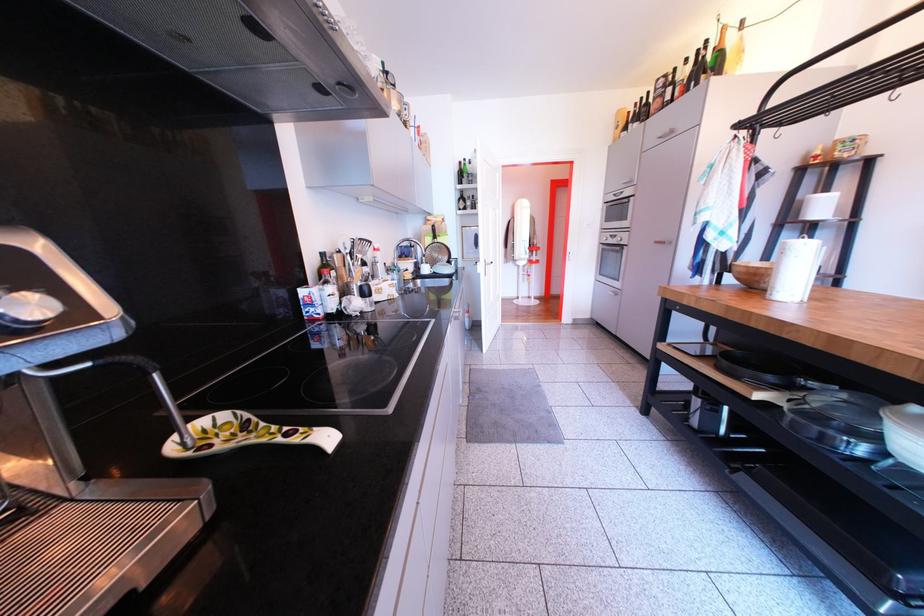
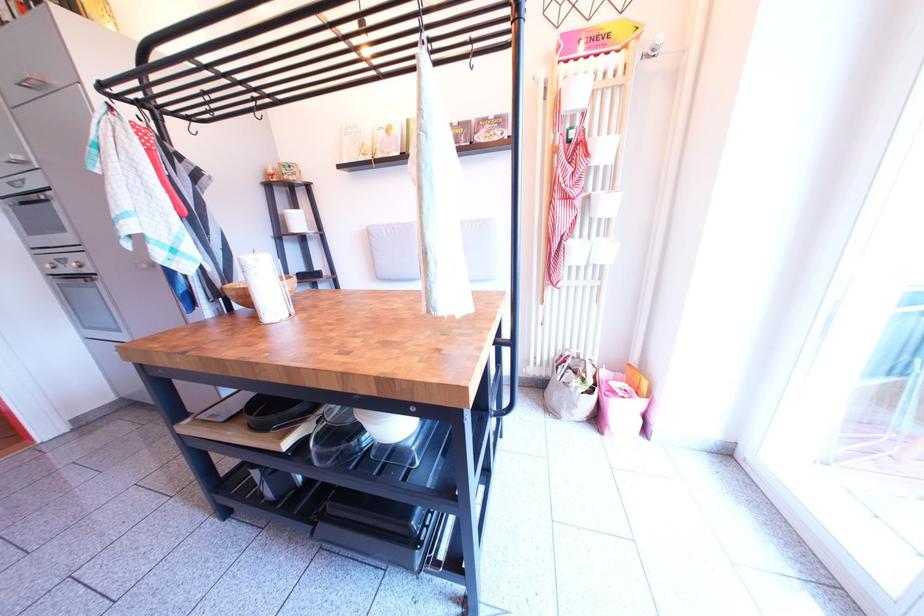
In the second image, find the point that corresponds to (624,243) in the first image.

(74, 267)